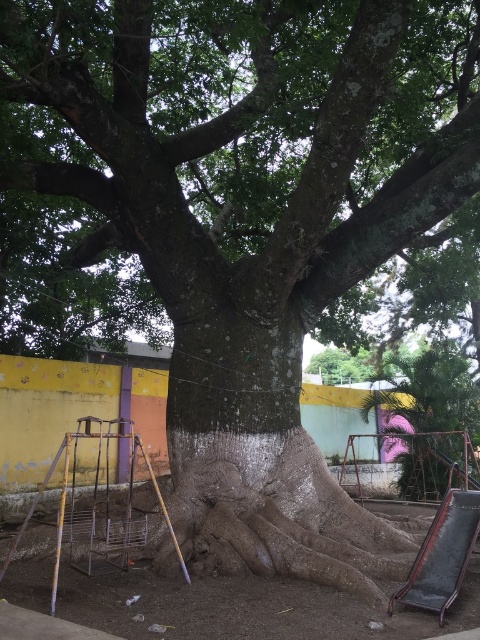
You are a painter standing at the base of the green rough textured tree at center and want to reach the metallic silver ladder at lower left to get a ladder. However, you only have a 5 meter long rope. Do you think the rope will be sufficient to reach the ladder?

The distance between the green rough textured tree at center and the metallic silver ladder at lower left is 5.28 meters. Since the rope is only 5 meters long, it will not be long enough to reach the ladder.

You are a painter standing in front of the colorful wall in the background. You want to paint the green rough textured tree at center and the metallic silver ladder at lower left. Which object should you look towards first if you want to paint the one that is positioned to the right?

You should look towards the green rough textured tree at center first because it is positioned to the right of the metallic silver ladder at lower left.

You are a painter standing at the base of the green rough textured tree at center and want to reach the top to paint its branches. You have the metallic silver ladder at lower left. Will the ladder be tall enough to reach the top of the tree?

The green rough textured tree at center is taller than the metallic silver ladder at lower left, so the ladder will not be tall enough to reach the top of the tree.